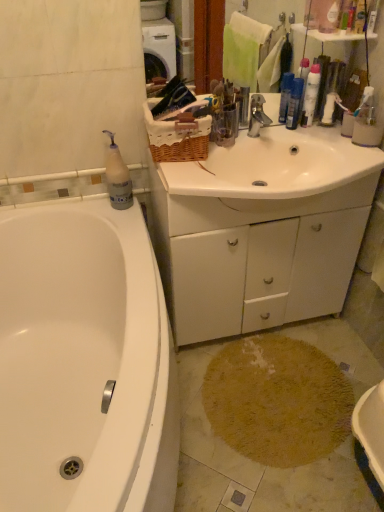
This screenshot has width=384, height=512. I want to click on free point in front of translucent plastic bottle at upper left, arranged as the 1th cleaning product when ordered from the bottom, so click(x=120, y=216).